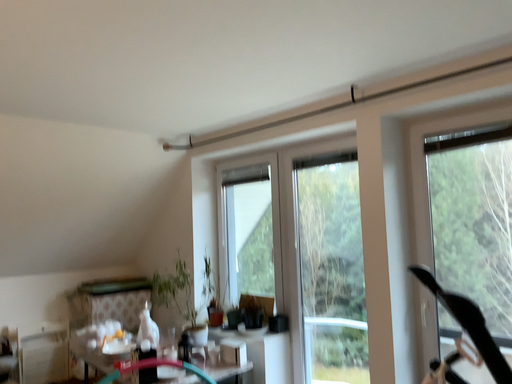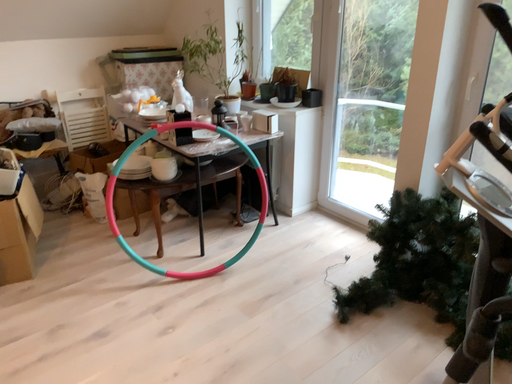
Question: Which way did the camera rotate in the video?

Choices:
 (A) rotated downward
 (B) rotated upward

Answer: (A)